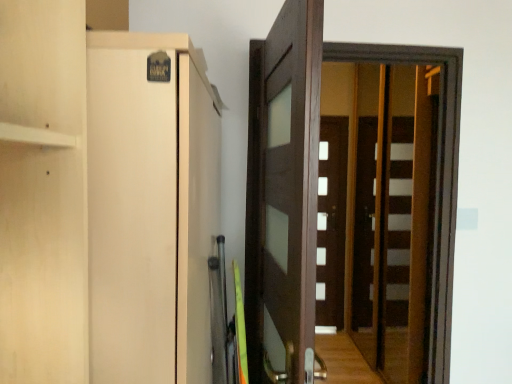
The width and height of the screenshot is (512, 384). Identify the location of white matte door at center, positioned as the second door in front-to-back order. (331, 221).

Describe the element at coordinates (283, 196) in the screenshot. The width and height of the screenshot is (512, 384). I see `dark wood door at center, the first door from the front` at that location.

Locate an element on the screen. The width and height of the screenshot is (512, 384). matte wood cabinet at left is located at coordinates (150, 208).

Is matte wood cabinet at left shorter than brown wooden screen door at center?

Yes.

Which object is closer to the camera taking this photo, matte wood cabinet at left or brown wooden screen door at center?

matte wood cabinet at left is in front.

Based on their sizes in the image, would you say matte wood cabinet at left is bigger or smaller than brown wooden screen door at center?

Clearly, matte wood cabinet at left is larger in size than brown wooden screen door at center.

Between matte wood cabinet at left and brown wooden screen door at center, which one appears on the left side from the viewer's perspective?

matte wood cabinet at left is more to the left.

Is dark wood door at center, acting as the second door starting from the back, inside or outside of matte wood cabinet at left?

dark wood door at center, acting as the second door starting from the back, cannot be found inside matte wood cabinet at left.

Considering the positions of objects dark wood door at center, arranged as the 1th door when viewed from the left, and matte wood cabinet at left in the image provided, who is more to the right, dark wood door at center, arranged as the 1th door when viewed from the left, or matte wood cabinet at left?

From the viewer's perspective, dark wood door at center, arranged as the 1th door when viewed from the left, appears more on the right side.

Is dark wood door at center, the first door from the front, oriented towards matte wood cabinet at left?

No, dark wood door at center, the first door from the front, is not facing towards matte wood cabinet at left.

How many degrees apart are the facing directions of dark wood door at center, arranged as the 1th door when viewed from the left, and matte wood cabinet at left?

The angular difference between dark wood door at center, arranged as the 1th door when viewed from the left, and matte wood cabinet at left is 84 degrees.

Does point (324, 263) come farther from viewer compared to point (169, 51)?

Yes, it is behind point (169, 51).

Considering the relative sizes of white matte door at center, which appears as the 1th door when viewed from the right, and matte wood cabinet at left in the image provided, is white matte door at center, which appears as the 1th door when viewed from the right, shorter than matte wood cabinet at left?

No.

Is white matte door at center, positioned as the second door in front-to-back order, oriented away from matte wood cabinet at left?

No, white matte door at center, positioned as the second door in front-to-back order, is not facing the opposite direction of matte wood cabinet at left.

Which door is the 2nd one when counting from the right side of the matte wood cabinet at left? Please provide its 2D coordinates.

[(331, 221)]

Is matte wood cabinet at left not close to white matte door at center, the second door from the left?

matte wood cabinet at left is far away from white matte door at center, the second door from the left.

From the image's perspective, which one is positioned lower, matte wood cabinet at left or white matte door at center, positioned as the second door in front-to-back order?

white matte door at center, positioned as the second door in front-to-back order, from the image's perspective.

In the scene shown: Does matte wood cabinet at left turn towards white matte door at center, the second door from the left?

No, matte wood cabinet at left is not oriented towards white matte door at center, the second door from the left.

Looking at their sizes, would you say matte wood cabinet at left is wider or thinner than white matte door at center, which appears as the 1th door when viewed from the right?

matte wood cabinet at left is wider than white matte door at center, which appears as the 1th door when viewed from the right.

Which is in front, matte wood cabinet at left or dark wood door at center, the first door from the front?

matte wood cabinet at left.

From a real-world perspective, is matte wood cabinet at left on top of dark wood door at center, acting as the second door starting from the back?

No, from a real-world perspective, matte wood cabinet at left is not over dark wood door at center, acting as the second door starting from the back

Based on the photo, is matte wood cabinet at left shorter than dark wood door at center, the 2th door from the right?

Yes.

Is matte wood cabinet at left turned away from dark wood door at center, acting as the second door starting from the back?

Yes, matte wood cabinet at left is facing away from dark wood door at center, acting as the second door starting from the back.

Identify the location of door directly beneath the dark wood door at center, arranged as the 1th door when viewed from the left (from a real-world perspective). Image resolution: width=512 pixels, height=384 pixels. (331, 221).

From a real-world perspective, between white matte door at center, which appears as the 1th door when viewed from the right, and dark wood door at center, arranged as the 1th door when viewed from the left, who is vertically lower?

white matte door at center, which appears as the 1th door when viewed from the right.

Does white matte door at center, the first door in the back-to-front sequence, have a greater width compared to dark wood door at center, acting as the second door starting from the back?

No, white matte door at center, the first door in the back-to-front sequence, is not wider than dark wood door at center, acting as the second door starting from the back.

In the image, is white matte door at center, which appears as the 1th door when viewed from the right, positioned in front of or behind dark wood door at center, acting as the second door starting from the back?

Clearly, white matte door at center, which appears as the 1th door when viewed from the right, is behind dark wood door at center, acting as the second door starting from the back.

Is brown wooden screen door at center bigger or smaller than dark wood door at center, the 2th door from the right?

In the image, brown wooden screen door at center appears to be smaller than dark wood door at center, the 2th door from the right.

Which is more to the right, brown wooden screen door at center or dark wood door at center, acting as the second door starting from the back?

Positioned to the right is brown wooden screen door at center.

Which object is further away from the camera, brown wooden screen door at center or dark wood door at center, the 2th door from the right?

brown wooden screen door at center is behind.

Are brown wooden screen door at center and dark wood door at center, the 2th door from the right, located far from each other?

That's not correct — brown wooden screen door at center is a little close to dark wood door at center, the 2th door from the right.

Find the location of a particular element. This screenshot has height=384, width=512. cabinetry in front of the brown wooden screen door at center is located at coordinates (150, 208).

Where is `door that is above the matte wood cabinet at left (from the image's perspective)`? The width and height of the screenshot is (512, 384). door that is above the matte wood cabinet at left (from the image's perspective) is located at coordinates (283, 196).

From the picture: Estimate the real-world distances between objects in this image. Which object is closer to white matte door at center, which appears as the 1th door when viewed from the right, dark wood door at center, arranged as the 1th door when viewed from the left, or matte wood cabinet at left?

dark wood door at center, arranged as the 1th door when viewed from the left, lies closer to white matte door at center, which appears as the 1th door when viewed from the right, than the other object.

Considering their positions, is brown wooden screen door at center positioned closer to dark wood door at center, acting as the second door starting from the back, than white matte door at center, positioned as the second door in front-to-back order?

The object closer to dark wood door at center, acting as the second door starting from the back, is brown wooden screen door at center.

Which object lies further to the anchor point dark wood door at center, arranged as the 1th door when viewed from the left, matte wood cabinet at left or brown wooden screen door at center?

Among the two, brown wooden screen door at center is located further to dark wood door at center, arranged as the 1th door when viewed from the left.

Looking at the image, which one is located closer to matte wood cabinet at left, dark wood door at center, acting as the second door starting from the back, or brown wooden screen door at center?

dark wood door at center, acting as the second door starting from the back, is closer to matte wood cabinet at left.

Based on their spatial positions, is matte wood cabinet at left or white matte door at center, the second door from the left, further from brown wooden screen door at center?

white matte door at center, the second door from the left.

Consider the image. Estimate the real-world distances between objects in this image. Which object is further from white matte door at center, positioned as the second door in front-to-back order, matte wood cabinet at left or dark wood door at center, the 2th door from the right?

matte wood cabinet at left is further to white matte door at center, positioned as the second door in front-to-back order.

Which object lies further to the anchor point matte wood cabinet at left, dark wood door at center, acting as the second door starting from the back, or white matte door at center, the first door in the back-to-front sequence?

white matte door at center, the first door in the back-to-front sequence, is positioned further to the anchor matte wood cabinet at left.

Which object lies nearer to the anchor point matte wood cabinet at left, white matte door at center, which appears as the 1th door when viewed from the right, or brown wooden screen door at center?

brown wooden screen door at center lies closer to matte wood cabinet at left than the other object.

Identify the location of door between matte wood cabinet at left and white matte door at center, the second door from the left, from front to back. (283, 196).

Where is `door between matte wood cabinet at left and brown wooden screen door at center from front to back`? door between matte wood cabinet at left and brown wooden screen door at center from front to back is located at coordinates click(283, 196).

Where is `screen door between matte wood cabinet at left and white matte door at center, which appears as the 1th door when viewed from the right, along the z-axis`? screen door between matte wood cabinet at left and white matte door at center, which appears as the 1th door when viewed from the right, along the z-axis is located at coordinates (437, 170).

The height and width of the screenshot is (384, 512). Find the location of `screen door between dark wood door at center, arranged as the 1th door when viewed from the left, and white matte door at center, which appears as the 1th door when viewed from the right, in the front-back direction`. screen door between dark wood door at center, arranged as the 1th door when viewed from the left, and white matte door at center, which appears as the 1th door when viewed from the right, in the front-back direction is located at coordinates (437, 170).